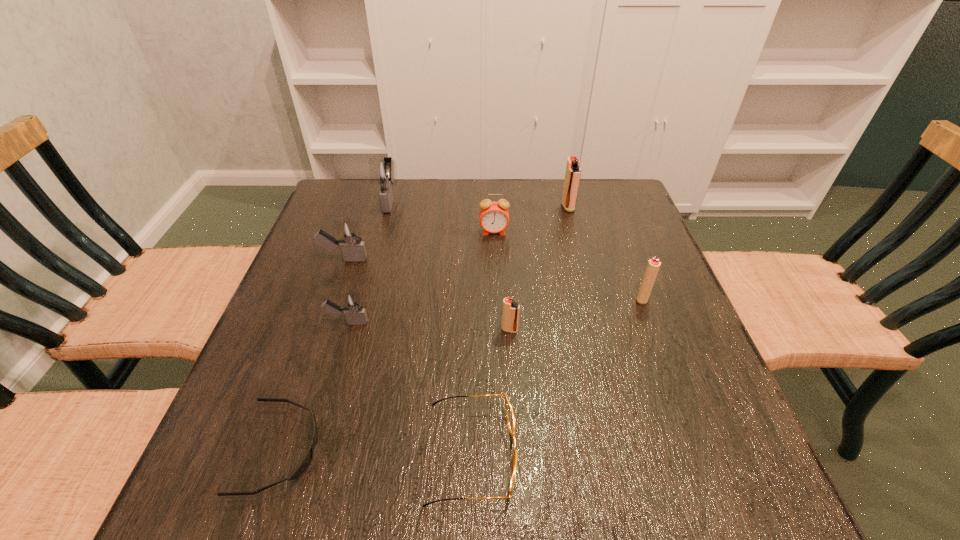
Find the location of a particular element. free location at the far edge of the desktop is located at coordinates (516, 205).

Where is `free location at the near edge`? free location at the near edge is located at coordinates (580, 466).

Find the location of a particular element. This screenshot has height=540, width=960. vacant space at the left edge of the desktop is located at coordinates (309, 388).

Where is `vacant space at the right edge of the desktop`? The height and width of the screenshot is (540, 960). vacant space at the right edge of the desktop is located at coordinates (x=629, y=249).

Locate an element on the screen. Image resolution: width=960 pixels, height=540 pixels. vacant space at the far right corner of the desktop is located at coordinates (622, 194).

Identify the location of empty space that is in between the second farthest gray igniter and the smallest gray igniter. The height and width of the screenshot is (540, 960). (346, 291).

You are a GUI agent. You are given a task and a screenshot of the screen. Output one action in this format:
    pyautogui.click(x=<x>, y=<y>)
    Task: Click on the vacant area that lies between the eighth object from left to right and the alarm clock
    The image size is (960, 540).
    Given the screenshot: What is the action you would take?
    pyautogui.click(x=531, y=220)

This screenshot has height=540, width=960. Find the location of `vacant space that's between the farthest red igniter and the fifth nearest object`. vacant space that's between the farthest red igniter and the fifth nearest object is located at coordinates (605, 253).

Find the location of a particular element. free space between the second nearest red igniter and the shortest object is located at coordinates (462, 374).

Where is `vacant point located between the alarm clock and the rightmost igniter`? vacant point located between the alarm clock and the rightmost igniter is located at coordinates (568, 265).